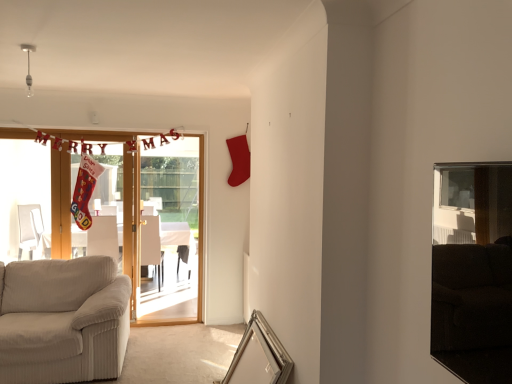
Question: Considering the relative positions of white fabric armchair at left, marked as the 2th armchair in a right-to-left arrangement, and metallic silver picture frame at lower center in the image provided, is white fabric armchair at left, marked as the 2th armchair in a right-to-left arrangement, behind metallic silver picture frame at lower center?

Choices:
 (A) no
 (B) yes

Answer: (B)

Question: Is white fabric armchair at left, marked as the 2th armchair in a right-to-left arrangement, closer to camera compared to metallic silver picture frame at lower center?

Choices:
 (A) no
 (B) yes

Answer: (A)

Question: Can you confirm if white fabric armchair at left, the 1th armchair when ordered from left to right, is taller than metallic silver picture frame at lower center?

Choices:
 (A) no
 (B) yes

Answer: (B)

Question: Can you confirm if white fabric armchair at left, marked as the 2th armchair in a right-to-left arrangement, is shorter than metallic silver picture frame at lower center?

Choices:
 (A) no
 (B) yes

Answer: (A)

Question: Is white fabric armchair at left, marked as the 2th armchair in a right-to-left arrangement, turned away from metallic silver picture frame at lower center?

Choices:
 (A) no
 (B) yes

Answer: (B)

Question: From a real-world perspective, is white fabric armchair at left, the 1th armchair when ordered from left to right, over metallic silver picture frame at lower center?

Choices:
 (A) no
 (B) yes

Answer: (B)

Question: Considering the relative sizes of white fabric armchair at center, positioned as the first armchair in right-to-left order, and white fabric armchair at left, the 1th armchair when ordered from left to right, in the image provided, is white fabric armchair at center, positioned as the first armchair in right-to-left order, smaller than white fabric armchair at left, the 1th armchair when ordered from left to right,?

Choices:
 (A) yes
 (B) no

Answer: (B)

Question: Can you confirm if white fabric armchair at center, positioned as the first armchair in right-to-left order, is positioned to the right of white fabric armchair at left, marked as the 2th armchair in a right-to-left arrangement?

Choices:
 (A) no
 (B) yes

Answer: (B)

Question: Is white fabric armchair at center, positioned as the first armchair in right-to-left order, positioned with its back to white fabric armchair at left, marked as the 2th armchair in a right-to-left arrangement?

Choices:
 (A) no
 (B) yes

Answer: (A)

Question: From a real-world perspective, is white fabric armchair at center, positioned as the first armchair in right-to-left order, on white fabric armchair at left, the 1th armchair when ordered from left to right?

Choices:
 (A) no
 (B) yes

Answer: (A)

Question: Considering the relative sizes of white fabric armchair at center, which ranks as the second armchair in left-to-right order, and white fabric armchair at left, the 1th armchair when ordered from left to right, in the image provided, is white fabric armchair at center, which ranks as the second armchair in left-to-right order, taller than white fabric armchair at left, the 1th armchair when ordered from left to right,?

Choices:
 (A) no
 (B) yes

Answer: (B)

Question: Considering the relative sizes of white fabric armchair at center, which ranks as the second armchair in left-to-right order, and white fabric armchair at left, the 1th armchair when ordered from left to right, in the image provided, is white fabric armchair at center, which ranks as the second armchair in left-to-right order, bigger than white fabric armchair at left, the 1th armchair when ordered from left to right,?

Choices:
 (A) no
 (B) yes

Answer: (B)

Question: Does wooden door at left come in front of metallic silver picture frame at lower center?

Choices:
 (A) no
 (B) yes

Answer: (A)